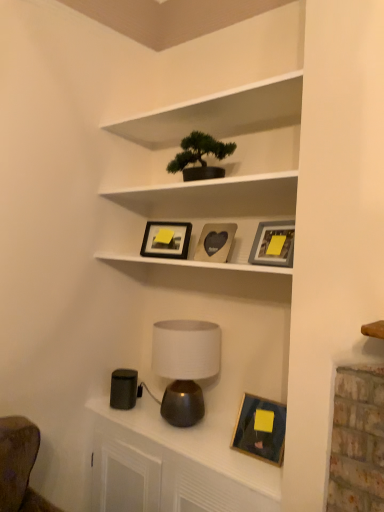
Locate an element on the screen. Image resolution: width=384 pixels, height=512 pixels. vacant space situated on the left part of wooden picture frame at lower right, positioned as the 1th picture frame in bottom-to-top order is located at coordinates (214, 451).